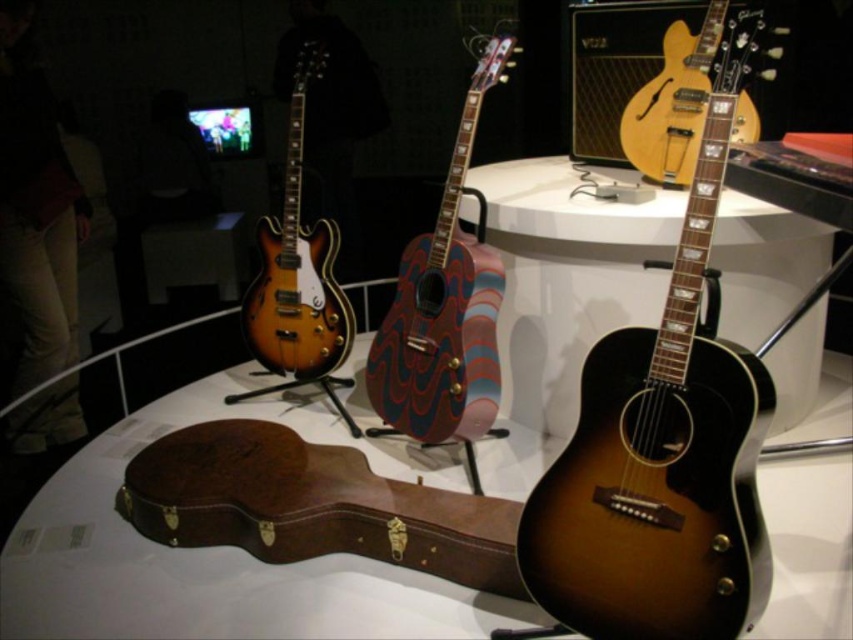
Question: Which point is farther from the camera taking this photo?

Choices:
 (A) (291, 257)
 (B) (664, 45)
 (C) (469, 282)

Answer: (A)

Question: Where is satin wood guitar at center located in relation to multicolored wood acoustic guitar at center in the image?

Choices:
 (A) below
 (B) above

Answer: (A)

Question: Can you confirm if multicolored wood acoustic guitar at center is positioned to the right of satin wood electric guitar at upper center?

Choices:
 (A) yes
 (B) no

Answer: (A)

Question: Observing the image, what is the correct spatial positioning of satin wood guitar at center in reference to sunburst wood electric guitar at upper right?

Choices:
 (A) right
 (B) left

Answer: (B)

Question: Which point appears farthest from the camera in this image?

Choices:
 (A) click(585, 577)
 (B) click(287, 358)
 (C) click(668, 49)
 (D) click(401, 276)

Answer: (B)

Question: Which point is closer to the camera?

Choices:
 (A) satin wood electric guitar at upper center
 (B) satin wood guitar at center

Answer: (B)